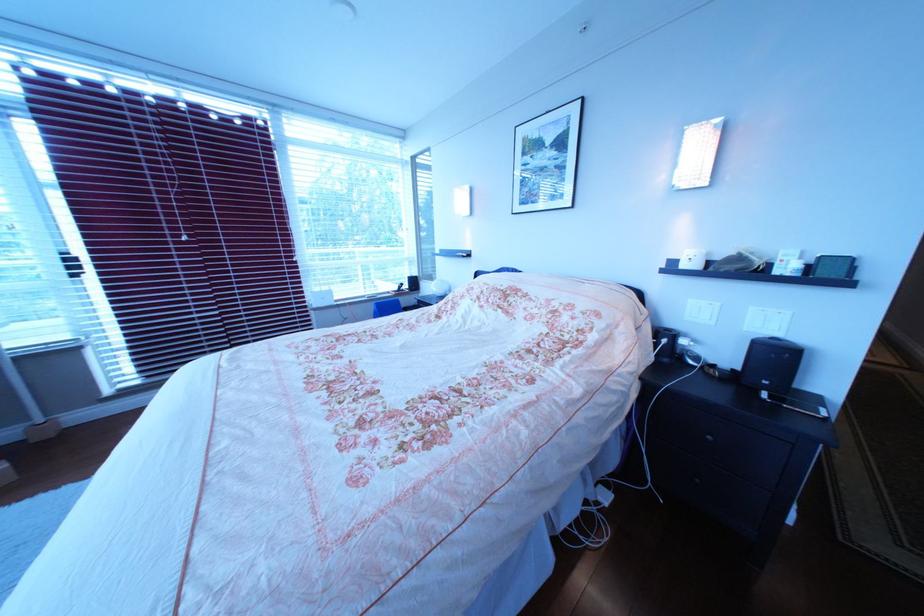
Where would you lift the black speaker? Please return your answer as a coordinate pair (x, y).

(771, 363)